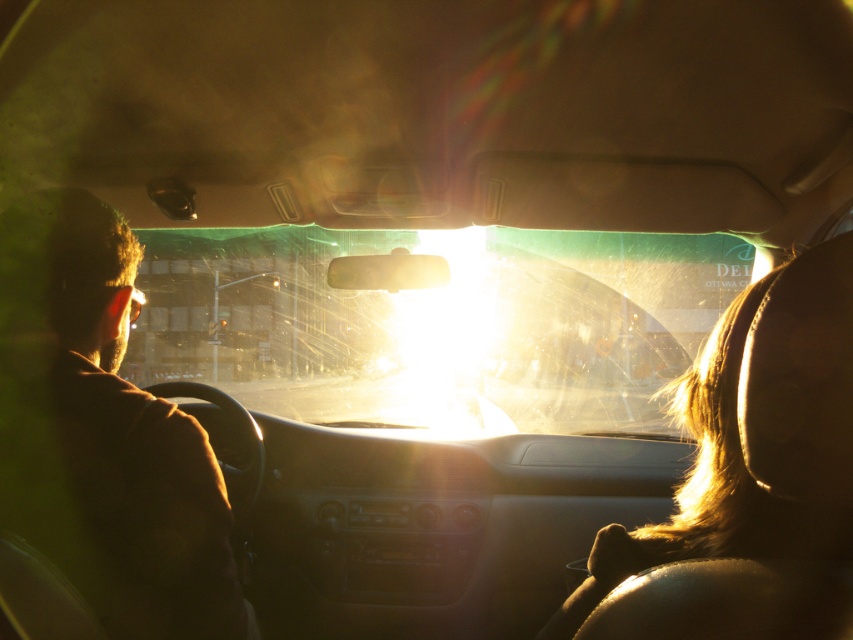
Question: Which point is closer to the camera?

Choices:
 (A) brown fuzzy jacket at left
 (B) blonde hair at right
 (C) transparent glass windshield at center

Answer: (B)

Question: Observing the image, what is the correct spatial positioning of transparent glass windshield at center in reference to blonde hair at right?

Choices:
 (A) left
 (B) right

Answer: (A)

Question: Is transparent glass windshield at center thinner than brown fuzzy jacket at left?

Choices:
 (A) no
 (B) yes

Answer: (A)

Question: Which of the following is the closest to the observer?

Choices:
 (A) brown fuzzy jacket at left
 (B) blonde hair at right

Answer: (B)

Question: Is transparent glass windshield at center below brown fuzzy jacket at left?

Choices:
 (A) no
 (B) yes

Answer: (A)

Question: Which of the following is the closest to the observer?

Choices:
 (A) (810, 394)
 (B) (682, 314)

Answer: (A)